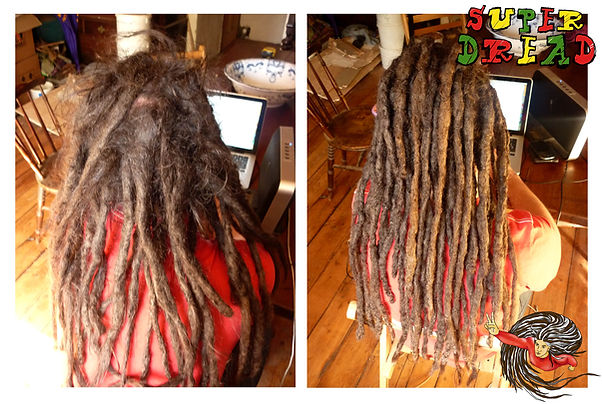
This screenshot has height=404, width=602. I want to click on laptop computer, so click(x=243, y=108), click(x=522, y=103).